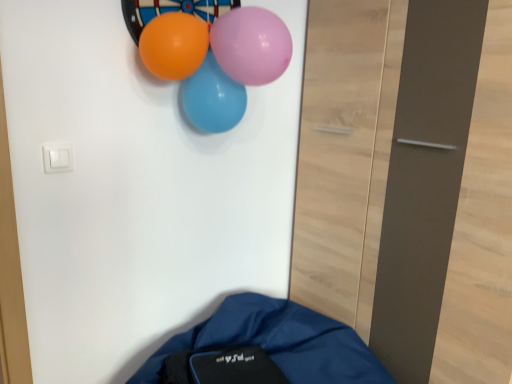
Question: In which direction should I rotate to look at purple glossy balloon at upper center, placed as the first balloon when sorted from front to back?

Choices:
 (A) right
 (B) left

Answer: (B)

Question: From a real-world perspective, is purple glossy balloon at upper center, placed as the first balloon when sorted from front to back, under orange glossy balloon at upper center, arranged as the 2th balloon when viewed from the front?

Choices:
 (A) no
 (B) yes

Answer: (A)

Question: Is purple glossy balloon at upper center, placed as the first balloon when sorted from front to back, with orange glossy balloon at upper center, the 2th balloon positioned from the back?

Choices:
 (A) no
 (B) yes

Answer: (A)

Question: Is purple glossy balloon at upper center, which is the 3th balloon in back-to-front order, aimed at orange glossy balloon at upper center, arranged as the 2th balloon when viewed from the front?

Choices:
 (A) no
 (B) yes

Answer: (A)

Question: Can you confirm if purple glossy balloon at upper center, placed as the first balloon when sorted from front to back, is positioned to the left of orange glossy balloon at upper center, the 2th balloon positioned from the back?

Choices:
 (A) no
 (B) yes

Answer: (A)

Question: Is purple glossy balloon at upper center, which is the 3th balloon in back-to-front order, far from orange glossy balloon at upper center, the 2th balloon positioned from the back?

Choices:
 (A) no
 (B) yes

Answer: (A)

Question: From a real-world perspective, is purple glossy balloon at upper center, placed as the first balloon when sorted from front to back, over orange glossy balloon at upper center, the 2th balloon positioned from the back?

Choices:
 (A) yes
 (B) no

Answer: (A)

Question: Is orange glossy balloon at upper center, arranged as the 2th balloon when viewed from the front, to the left of blue glossy balloon at upper center, arranged as the 1th balloon when viewed from the back, from the viewer's perspective?

Choices:
 (A) no
 (B) yes

Answer: (B)

Question: Considering the relative sizes of orange glossy balloon at upper center, arranged as the 2th balloon when viewed from the front, and blue glossy balloon at upper center, arranged as the 1th balloon when viewed from the back, in the image provided, is orange glossy balloon at upper center, arranged as the 2th balloon when viewed from the front, smaller than blue glossy balloon at upper center, arranged as the 1th balloon when viewed from the back,?

Choices:
 (A) no
 (B) yes

Answer: (B)

Question: Is orange glossy balloon at upper center, the 2th balloon positioned from the back, bigger than blue glossy balloon at upper center, arranged as the 1th balloon when viewed from the back?

Choices:
 (A) yes
 (B) no

Answer: (B)

Question: Is orange glossy balloon at upper center, the 2th balloon positioned from the back, outside of blue glossy balloon at upper center, arranged as the 1th balloon when viewed from the back?

Choices:
 (A) yes
 (B) no

Answer: (A)

Question: Does orange glossy balloon at upper center, the 2th balloon positioned from the back, have a greater height compared to blue glossy balloon at upper center, the third balloon from the front?

Choices:
 (A) yes
 (B) no

Answer: (B)

Question: Would you say blue glossy balloon at upper center, arranged as the 1th balloon when viewed from the back, is part of orange glossy balloon at upper center, the 2th balloon positioned from the back,'s contents?

Choices:
 (A) yes
 (B) no

Answer: (B)

Question: Is purple glossy balloon at upper center, which is the 3th balloon in back-to-front order, facing towards blue glossy balloon at upper center, the third balloon from the front?

Choices:
 (A) yes
 (B) no

Answer: (B)